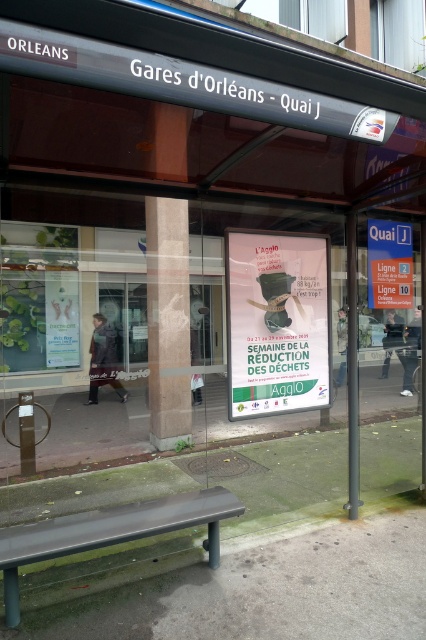
You are a traveler at the bus stop and need to sit down. The white paper poster at center is blocking your view of the schedule. Can you move the black plastic bench at lower center to the side to get a better look?

The white paper poster at center is taller than the black plastic bench at lower center, so moving the bench might not help since the poster is taller and would still block the view.

You are at the bus stop and want to read both the white paper poster at center and the white paper sign at center. Which one do you need to move closer to in order to read the text clearly?

The white paper poster at center has a larger width than the white paper sign at center, so you need to move closer to the white paper sign at center to read its text clearly.

You are a tourist at the bus stop and want to read both the white paper poster at center and the white paper sign at center. Which one should you look at first to see the campaign details?

The white paper poster at center is below the white paper sign at center, so you should look at the white paper sign at center first as it is higher up.